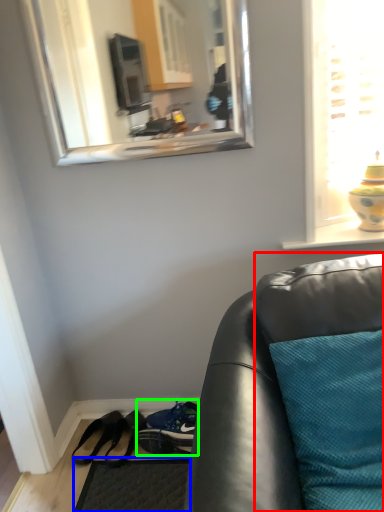
Question: Which is farther away from cushion (highlighted by a red box)? flat (highlighted by a blue box) or shoe (highlighted by a green box)?

Choices:
 (A) flat
 (B) shoe

Answer: (A)